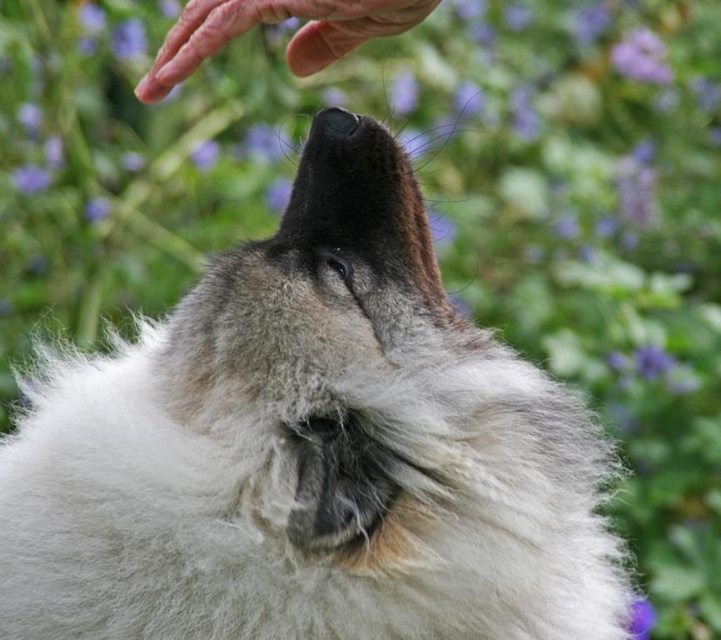
Question: Which of the following is the closest to the observer?

Choices:
 (A) coord(167,60)
 (B) coord(650,70)

Answer: (A)

Question: Does dry skin at upper center come in front of purple matte flower at upper right?

Choices:
 (A) yes
 (B) no

Answer: (A)

Question: Which of the following is the closest to the observer?

Choices:
 (A) dry skin at upper center
 (B) purple matte flower at upper right

Answer: (A)

Question: Considering the relative positions of dry skin at upper center and purple matte flower at upper right in the image provided, where is dry skin at upper center located with respect to purple matte flower at upper right?

Choices:
 (A) right
 (B) left

Answer: (B)

Question: Can you confirm if dry skin at upper center is positioned above purple matte flower at upper right?

Choices:
 (A) no
 (B) yes

Answer: (A)

Question: Which object appears farthest from the camera in this image?

Choices:
 (A) purple matte flower at upper right
 (B) dry skin at upper center

Answer: (A)